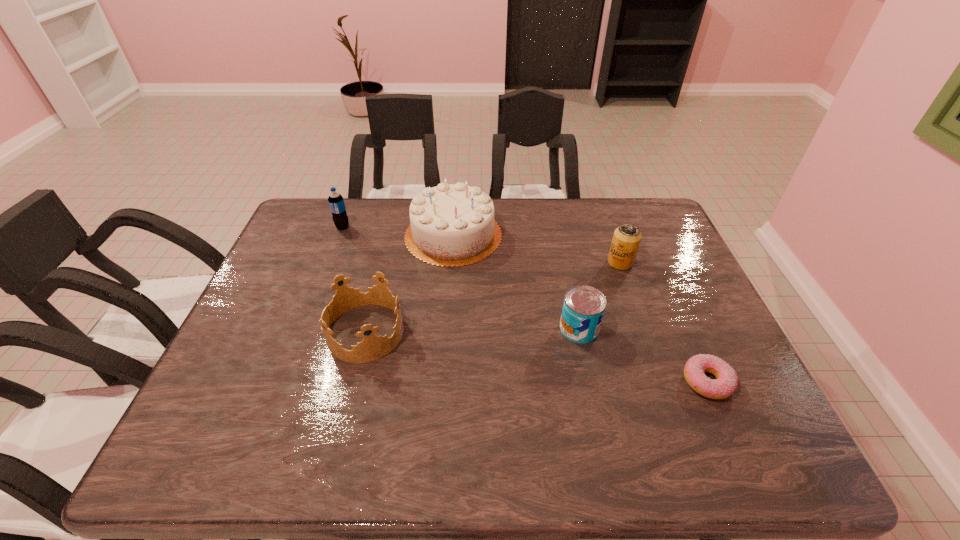
Image resolution: width=960 pixels, height=540 pixels. In order to click on the tallest object in this screenshot , I will do `click(451, 225)`.

I want to click on the leftmost object, so click(336, 202).

Where is `the second object from right to left`? This screenshot has width=960, height=540. the second object from right to left is located at coordinates (626, 240).

This screenshot has height=540, width=960. In order to click on tiara in this screenshot , I will do tap(372, 347).

Locate an element on the screen. the third object from right to left is located at coordinates (583, 309).

Locate an element on the screen. This screenshot has height=540, width=960. the second shortest object is located at coordinates (583, 309).

Identify the location of the shortest object. This screenshot has width=960, height=540. (x=726, y=382).

Where is `doughnut`? doughnut is located at coordinates (726, 382).

Where is `vacant space situated 0.340m on the front of the tallest object`? This screenshot has height=540, width=960. vacant space situated 0.340m on the front of the tallest object is located at coordinates (444, 362).

You are a GUI agent. You are given a task and a screenshot of the screen. Output one action in this format:
    pyautogui.click(x=<x>, y=<y>)
    Task: Click on the free point located on the front of the soda bottle
    The width and height of the screenshot is (960, 540).
    Given the screenshot: What is the action you would take?
    pyautogui.click(x=335, y=247)